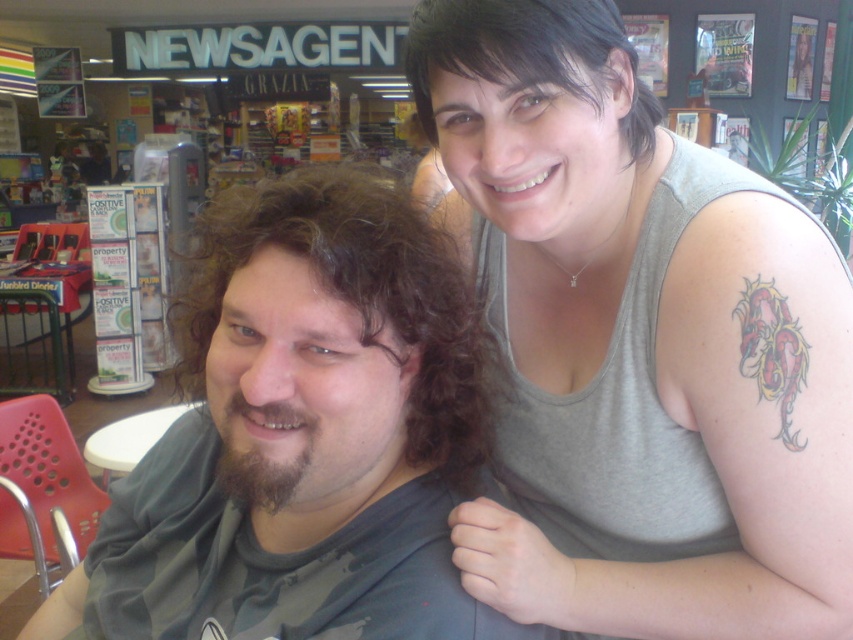
Question: Which of these objects is positioned closest to the black matte hair at upper center?

Choices:
 (A) gray tank top at upper right
 (B) dark curly hair at left

Answer: (B)

Question: Which object is farther from the camera taking this photo?

Choices:
 (A) black matte hair at upper center
 (B) dark curly hair at left

Answer: (A)

Question: Is gray tank top at upper right below gray matte shirt at center?

Choices:
 (A) no
 (B) yes

Answer: (A)

Question: Can you confirm if gray tank top at upper right is thinner than black matte hair at upper center?

Choices:
 (A) no
 (B) yes

Answer: (A)

Question: Which of the following is the farthest from the observer?

Choices:
 (A) black matte hair at upper center
 (B) gray matte shirt at center
 (C) dark curly hair at left
 (D) gray tank top at upper right

Answer: (D)

Question: Is gray tank top at upper right bigger than dark curly hair at left?

Choices:
 (A) no
 (B) yes

Answer: (B)